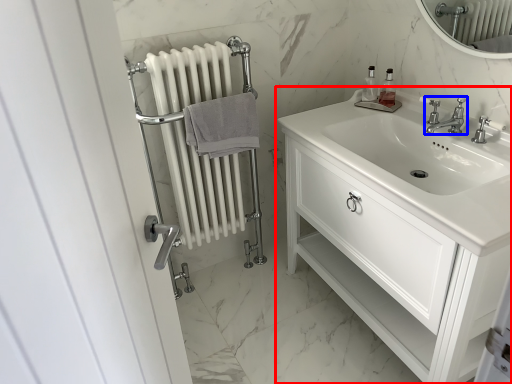
Question: Which of the following is the closest to the observer, bathroom cabinet (highlighted by a red box) or tap (highlighted by a blue box)?

Choices:
 (A) bathroom cabinet
 (B) tap

Answer: (A)